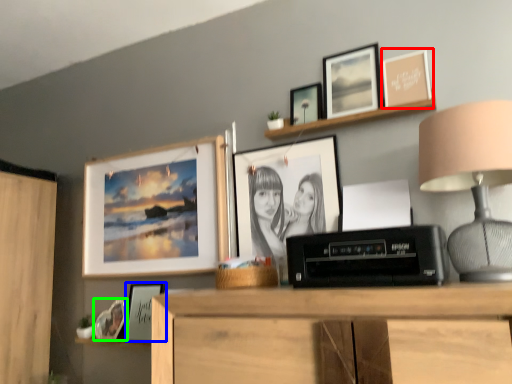
Question: Which object is the farthest from picture frame (highlighted by a red box)? Choose among these: picture frame (highlighted by a blue box) or picture frame (highlighted by a green box).

Choices:
 (A) picture frame
 (B) picture frame

Answer: (B)